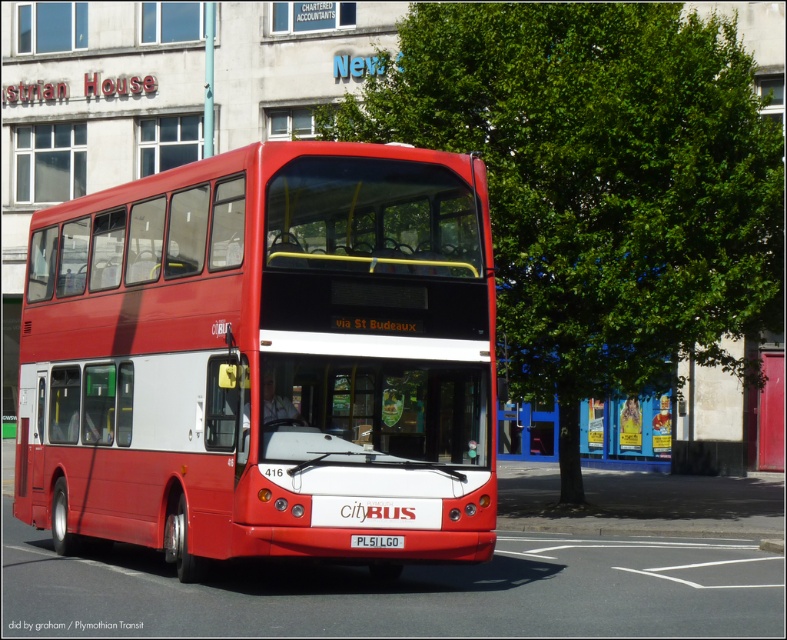
Is shiny red bus at center to the right of white plastic license plate at center from the viewer's perspective?

Incorrect, shiny red bus at center is not on the right side of white plastic license plate at center.

Looking at this image, between shiny red bus at center and white plastic license plate at center, which one appears on the right side from the viewer's perspective?

From the viewer's perspective, white plastic license plate at center appears more on the right side.

The image size is (787, 640). I want to click on shiny red bus at center, so click(263, 358).

Locate an element on the screen. Image resolution: width=787 pixels, height=640 pixels. shiny red bus at center is located at coordinates (263, 358).

Can you confirm if blue painted metal bus stop at center is shorter than white plastic license plate at center?

Incorrect, blue painted metal bus stop at center's height does not fall short of white plastic license plate at center's.

Who is more forward, (630,461) or (366,545)?

Point (366,545) is more forward.

Is point (555, 429) farther from camera compared to point (383, 547)?

That is True.

Where is `blue painted metal bus stop at center`? blue painted metal bus stop at center is located at coordinates coord(625,433).

Does shiny red bus at center have a lesser width compared to blue painted metal bus stop at center?

Yes, shiny red bus at center is thinner than blue painted metal bus stop at center.

Between shiny red bus at center and blue painted metal bus stop at center, which one is positioned lower?

blue painted metal bus stop at center

What do you see at coordinates (263, 358) in the screenshot? I see `shiny red bus at center` at bounding box center [263, 358].

Identify the location of shiny red bus at center. The image size is (787, 640). (263, 358).